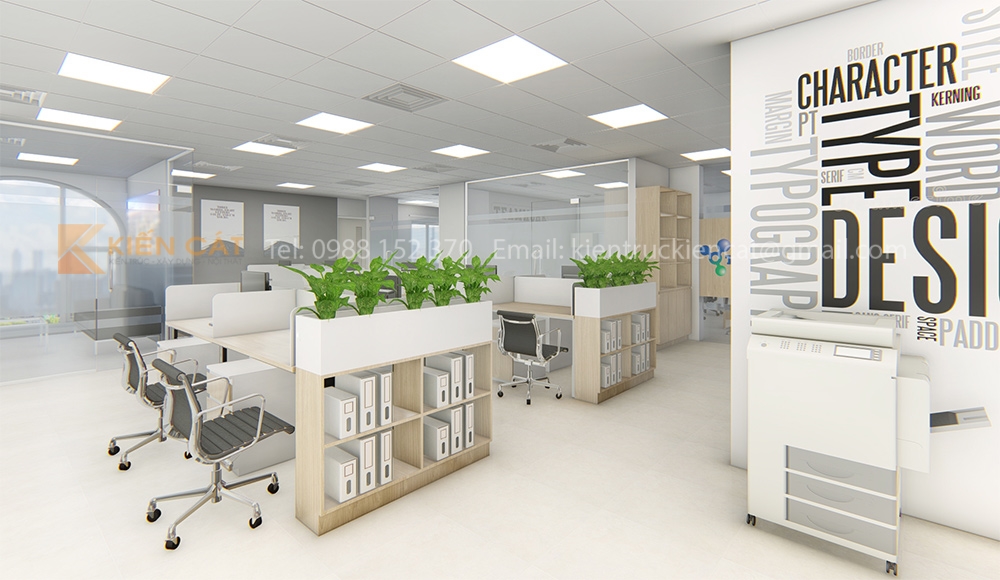
Locate an element on the screen. The width and height of the screenshot is (1000, 580). copier is located at coordinates (872, 380).